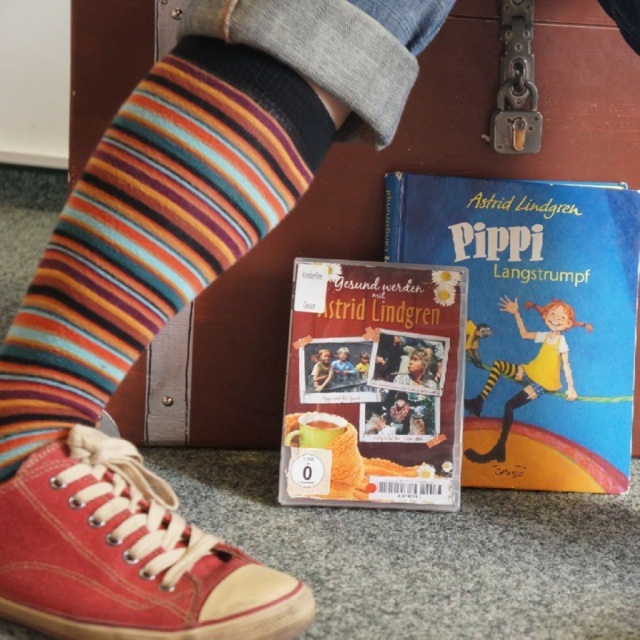
Question: Which object is the closest to the canvas shoe at lower left?

Choices:
 (A) smooth blue shirt at center
 (B) blue paperback book at center

Answer: (A)

Question: Is canvas shoe at lower left bigger than smooth skin face at center?

Choices:
 (A) no
 (B) yes

Answer: (B)

Question: Is matte cardboard book at center below smooth plastic dvd case at center?

Choices:
 (A) yes
 (B) no

Answer: (A)

Question: Which point is farther to the camera?

Choices:
 (A) yellow cotton dress at center
 (B) smooth blue shirt at center
 (C) smooth skin face at center
 (D) matte cardboard book at center

Answer: (A)

Question: Is yellow cotton dress at center thinner than smooth skin face at center?

Choices:
 (A) no
 (B) yes

Answer: (A)

Question: Estimate the real-world distances between objects in this image. Which object is closer to the smooth skin face at center?

Choices:
 (A) blue paperback book at center
 (B) smooth blue shirt at center

Answer: (B)